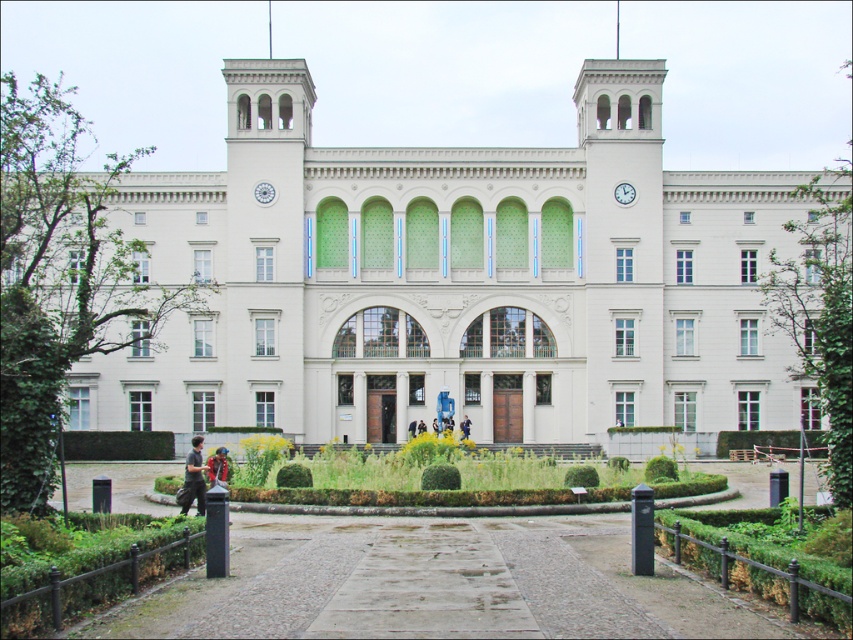
Question: Is white stone building at center thinner than dark blue jeans at center?

Choices:
 (A) no
 (B) yes

Answer: (A)

Question: Is dark gray fabric jacket at lower left smaller than multicolored fabric at lower center?

Choices:
 (A) no
 (B) yes

Answer: (A)

Question: Which is farther from the dark gray fabric jacket at lower left?

Choices:
 (A) green grass at center
 (B) dark blue jeans at center
 (C) white stone building at center

Answer: (B)

Question: Which object appears farthest from the camera in this image?

Choices:
 (A) dark gray fabric jacket at lower left
 (B) dark blue jeans at center

Answer: (B)

Question: Among these objects, which one is nearest to the camera?

Choices:
 (A) dark blue jeans at center
 (B) white stone building at center
 (C) multicolored fabric at lower center
 (D) green grass at center

Answer: (D)

Question: Is green leafy hedge at center above green grass at center?

Choices:
 (A) no
 (B) yes

Answer: (A)